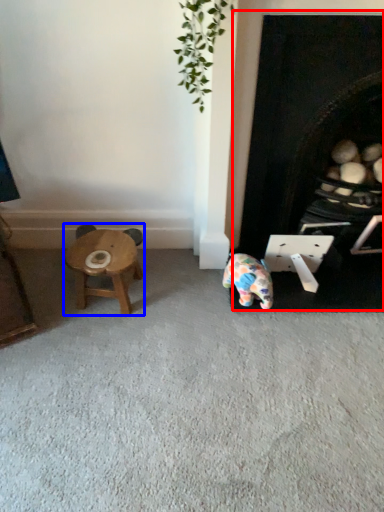
Question: Which of the following is the farthest to the observer, fireplace (highlighted by a red box) or stool (highlighted by a blue box)?

Choices:
 (A) fireplace
 (B) stool

Answer: (B)